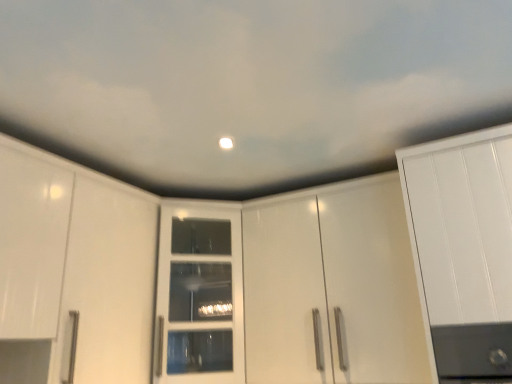
Where is `white glossy cabinet door at center`? This screenshot has height=384, width=512. white glossy cabinet door at center is located at coordinates (199, 297).

What do you see at coordinates (199, 297) in the screenshot? I see `white glossy cabinet door at center` at bounding box center [199, 297].

Describe the element at coordinates (333, 287) in the screenshot. I see `glossy white cabinet at center` at that location.

At what (x,y) coordinates should I click in order to perform the action: click on glossy white cabinet at center. Please return your answer as a coordinate pair (x, y). The height and width of the screenshot is (384, 512). Looking at the image, I should click on (333, 287).

Find the location of a particular element. white glossy cabinet door at center is located at coordinates (199, 297).

Is white glossy cabinet door at center to the left of glossy white cabinet at center from the viewer's perspective?

Yes.

Is white glossy cabinet door at center further to camera compared to glossy white cabinet at center?

That is True.

Is point (208, 209) positioned in front of point (406, 275)?

No, it is not.

From the image's perspective, relative to glossy white cabinet at center, is white glossy cabinet door at center above or below?

Based on their image positions, white glossy cabinet door at center is located beneath glossy white cabinet at center.

From a real-world perspective, who is located higher, white glossy cabinet door at center or glossy white cabinet at center?

white glossy cabinet door at center.

Considering the relative sizes of white glossy cabinet door at center and glossy white cabinet at center in the image provided, is white glossy cabinet door at center wider than glossy white cabinet at center?

Correct, the width of white glossy cabinet door at center exceeds that of glossy white cabinet at center.

Is white glossy cabinet door at center shorter than glossy white cabinet at center?

Indeed, white glossy cabinet door at center has a lesser height compared to glossy white cabinet at center.

Looking at the image, does white glossy cabinet door at center seem bigger or smaller compared to glossy white cabinet at center?

Considering their sizes, white glossy cabinet door at center takes up less space than glossy white cabinet at center.

Is white glossy cabinet door at center spatially inside glossy white cabinet at center, or outside of it?

white glossy cabinet door at center cannot be found inside glossy white cabinet at center.

Is the surface of white glossy cabinet door at center in direct contact with glossy white cabinet at center?

white glossy cabinet door at center and glossy white cabinet at center are clearly separated.

Is white glossy cabinet door at center looking in the opposite direction of glossy white cabinet at center?

No, white glossy cabinet door at center is not facing away from glossy white cabinet at center.

How many degrees apart are the facing directions of white glossy cabinet door at center and glossy white cabinet at center?

The angle between the facing direction of white glossy cabinet door at center and the facing direction of glossy white cabinet at center is 36.8 degrees.

Where is `door that is behind the glossy white cabinet at center`? door that is behind the glossy white cabinet at center is located at coordinates (199, 297).

Which is more to the left, glossy white cabinet at center or white glossy cabinet door at center?

white glossy cabinet door at center.

Which is in front, glossy white cabinet at center or white glossy cabinet door at center?

glossy white cabinet at center is closer to the camera.

Considering the positions of point (267, 382) and point (209, 379), is point (267, 382) closer or farther from the camera than point (209, 379)?

Point (267, 382).

From the image's perspective, relative to white glossy cabinet door at center, is glossy white cabinet at center above or below?

Based on their image positions, glossy white cabinet at center is located above white glossy cabinet door at center.

From a real-world perspective, is glossy white cabinet at center physically below white glossy cabinet door at center?

Yes, from a real-world perspective, glossy white cabinet at center is below white glossy cabinet door at center.

Consider the image. Considering the relative sizes of glossy white cabinet at center and white glossy cabinet door at center in the image provided, is glossy white cabinet at center thinner than white glossy cabinet door at center?

Indeed, glossy white cabinet at center has a lesser width compared to white glossy cabinet door at center.

Who is shorter, glossy white cabinet at center or white glossy cabinet door at center?

white glossy cabinet door at center.

From the picture: Is glossy white cabinet at center smaller than white glossy cabinet door at center?

No.

Is glossy white cabinet at center spatially inside white glossy cabinet door at center, or outside of it?

glossy white cabinet at center lies outside white glossy cabinet door at center.

Would you say glossy white cabinet at center is a long distance from white glossy cabinet door at center?

They are positioned close to each other.

Is glossy white cabinet at center looking in the opposite direction of white glossy cabinet door at center?

glossy white cabinet at center is not turned away from white glossy cabinet door at center.

Can you tell me how much glossy white cabinet at center and white glossy cabinet door at center differ in facing direction?

The angle between the facing direction of glossy white cabinet at center and the facing direction of white glossy cabinet door at center is 36.8 degrees.

Find the location of a particular element. cabinetry in front of the white glossy cabinet door at center is located at coordinates (333, 287).

The width and height of the screenshot is (512, 384). Find the location of `door to the left of glossy white cabinet at center`. door to the left of glossy white cabinet at center is located at coordinates (199, 297).

Find the location of a particular element. Image resolution: width=512 pixels, height=384 pixels. door behind the glossy white cabinet at center is located at coordinates (199, 297).